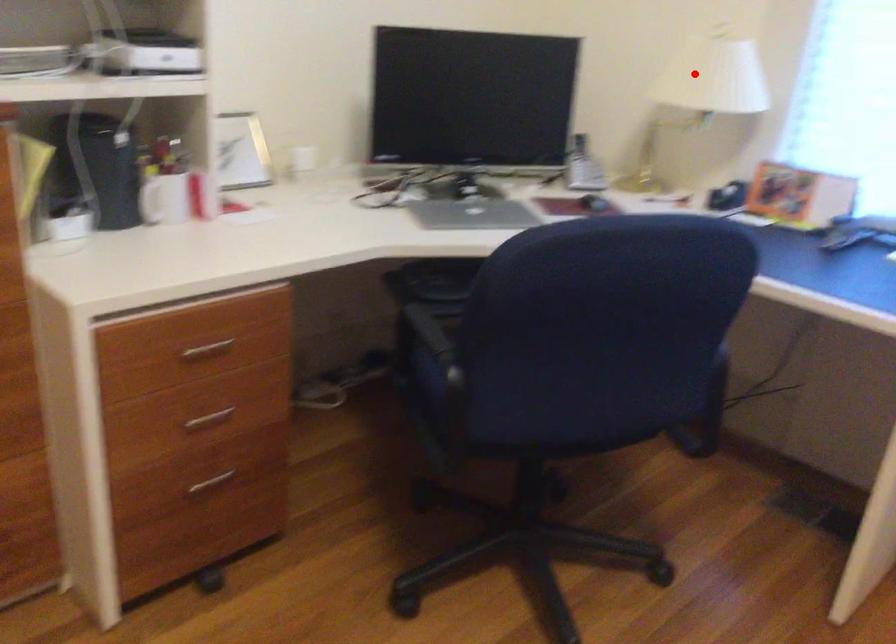
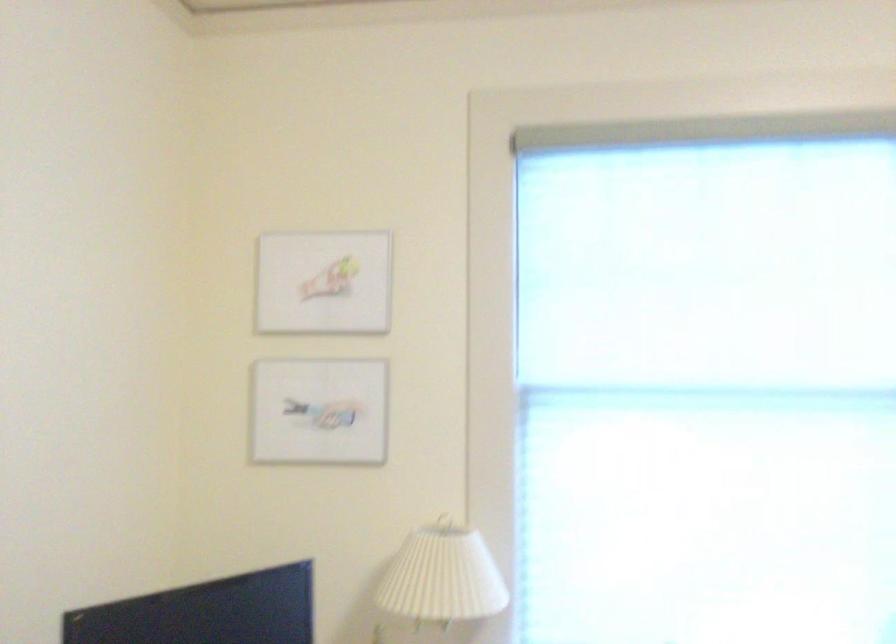
Question: I am providing you with two images of the same scene from different viewpoints. Given a red point in image1, look at the same physical point in image2. Is it:

Choices:
 (A) Closer to the viewpoint
 (B) Farther from the viewpoint

Answer: (A)